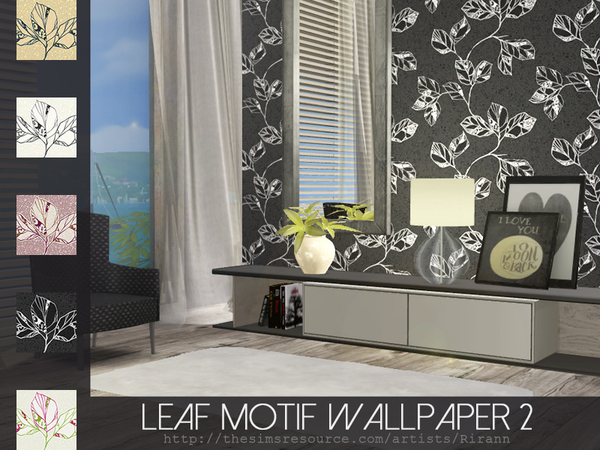
Find the location of a particular element. wall is located at coordinates (530, 94), (264, 203).